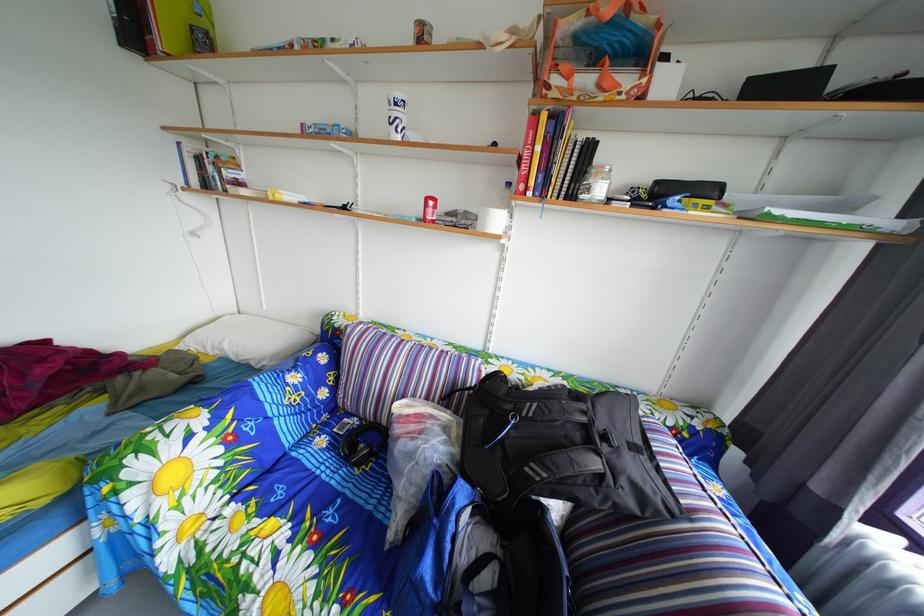
Find the location of a particular element. The height and width of the screenshot is (616, 924). sofa armrest is located at coordinates (675, 554).